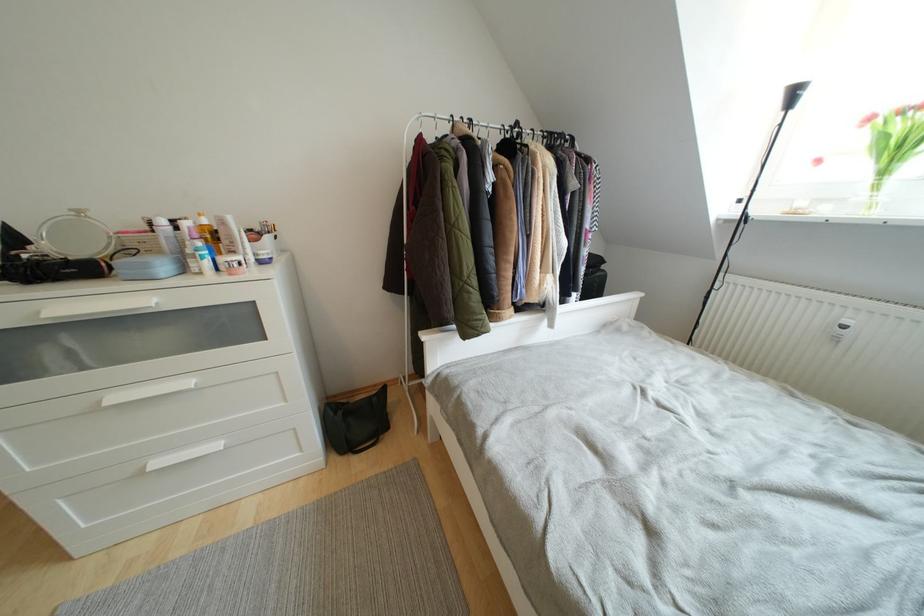
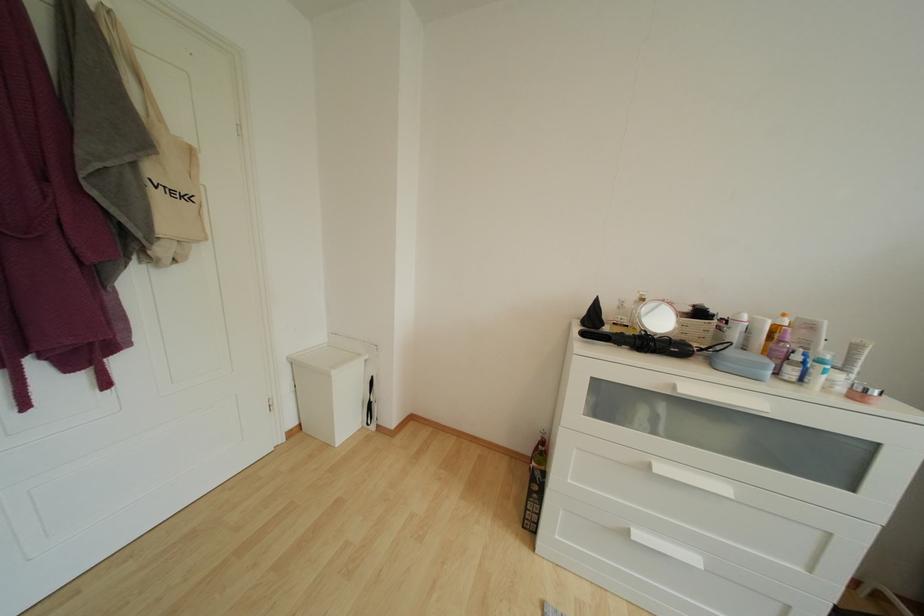
Where in the second image is the point corresponding to (x=96, y=220) from the first image?

(651, 301)